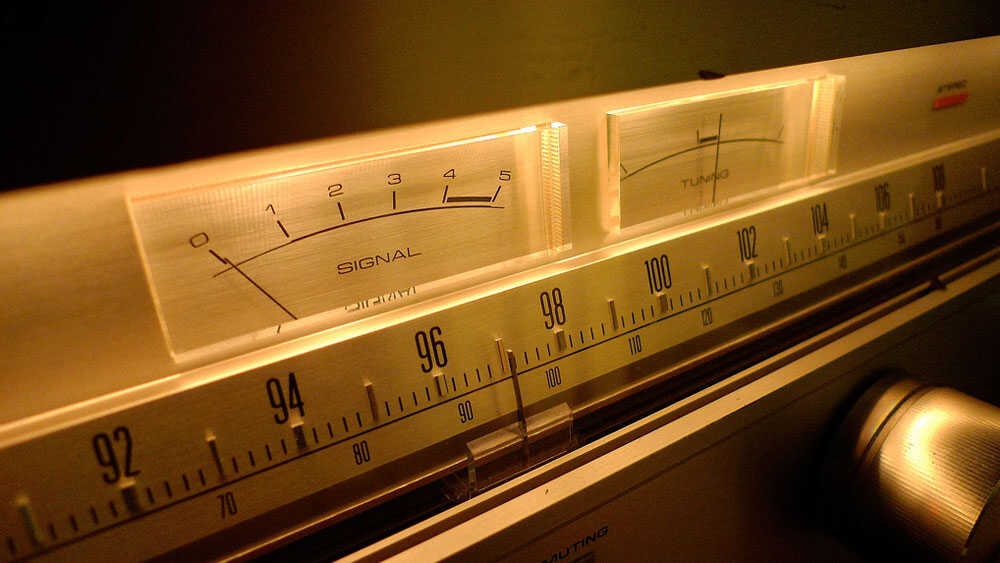
Identify the location of lighting. (521, 133), (436, 151).